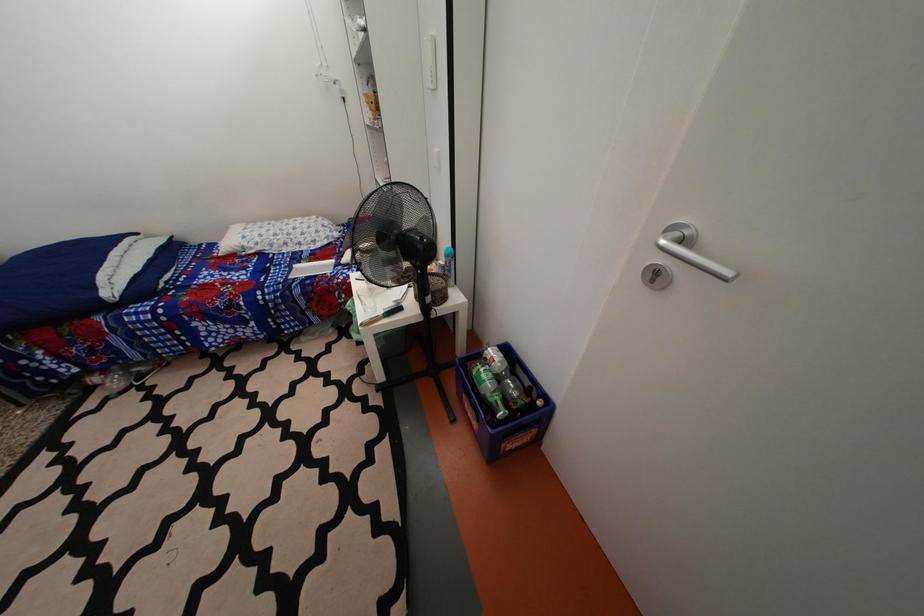
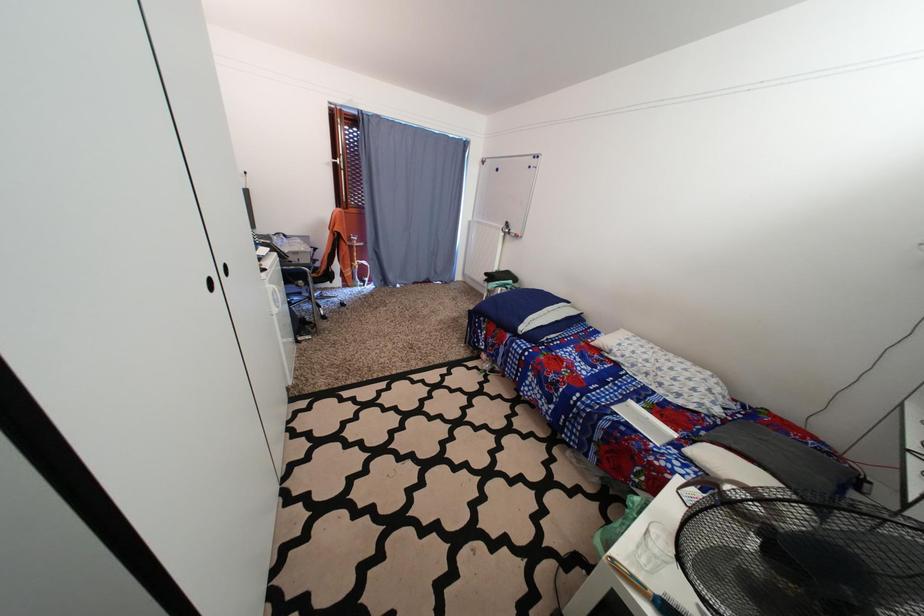
Question: Based on the continuous images, in which direction is the camera rotating? Reply with the corresponding letter.

Choices:
 (A) Left
 (B) Right
 (C) Up
 (D) Down

Answer: (A)